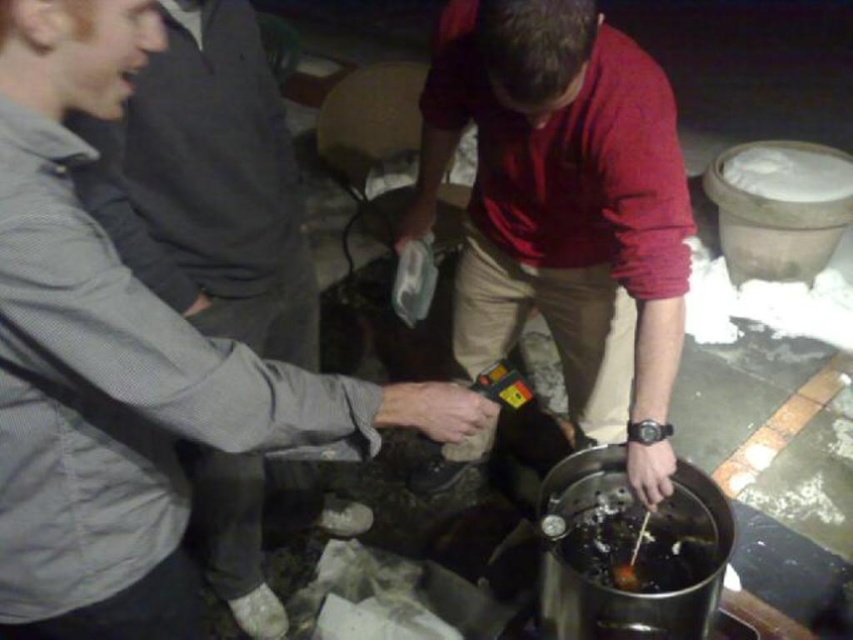
You are a food safety inspector checking the cooking process. You see the gray fabric jacket at left and the brown matte food at center. Which object is positioned higher in the scene?

The gray fabric jacket at left is positioned higher than the brown matte food at center in the scene.

You are a photographer trying to capture a clear image of both the matte red shirt at center and the gray fabric jacket at left. Since the camera can only focus on one object at a time, which object should you focus on first to ensure it appears larger in the photo?

The matte red shirt at center should be focused on first because it has a greater height compared to the gray fabric jacket at left, making it naturally larger in the frame.